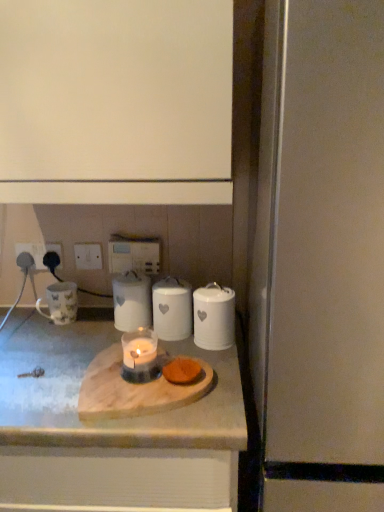
Image resolution: width=384 pixels, height=512 pixels. What are the coordinates of `spots to the right of translucent glass candle at center` in the screenshot? It's located at (218, 383).